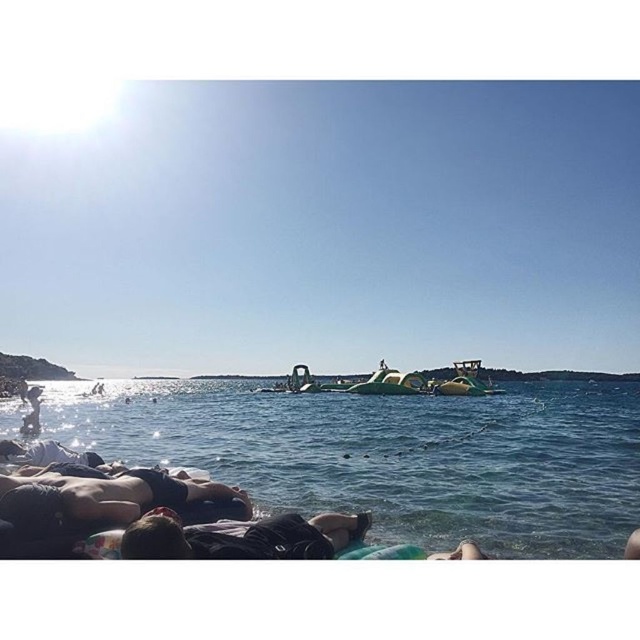
You are standing on the beach looking at two points marked in the scene. Which point is closer to you, point [6,520] or point [285,536]?

Point [6,520] is closer to you because it is further to the viewer than point [285,536].

You are a photographer trying to capture a photo of the beach scene. You want to ensure both the black fabric person at lower center and the smooth skin person at lower left are clearly visible in the frame. Which person should you focus on first to ensure both are in focus?

You should focus on the black fabric person at lower center first because they are in front of the smooth skin person at lower left, so focusing on the front subject will keep both in focus.

You are a photographer standing at the beach and want to capture a photo of the dark skin human at lower left and the black fabric person at lower center. Which one is located more to the left side of the frame?

The dark skin human at lower left is positioned on the left side of black fabric person at lower center, so the dark skin human at lower left is more to the left side of the frame.